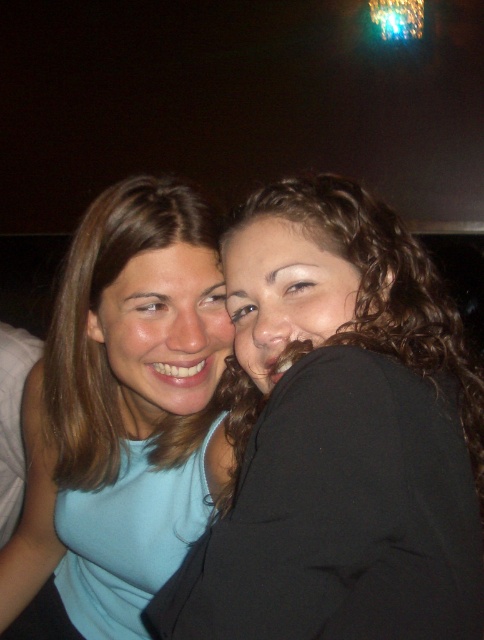
Can you confirm if matte black jacket at center is positioned below light blue fabric at center?

No, matte black jacket at center is not below light blue fabric at center.

Locate an element on the screen. matte black jacket at center is located at coordinates 337,435.